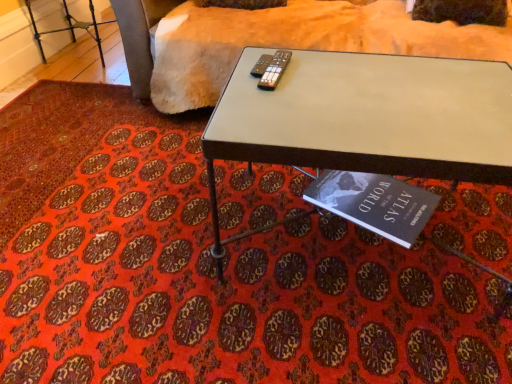
What are the coordinates of `free location to the left of metallic gray table at center` in the screenshot? It's located at (137, 248).